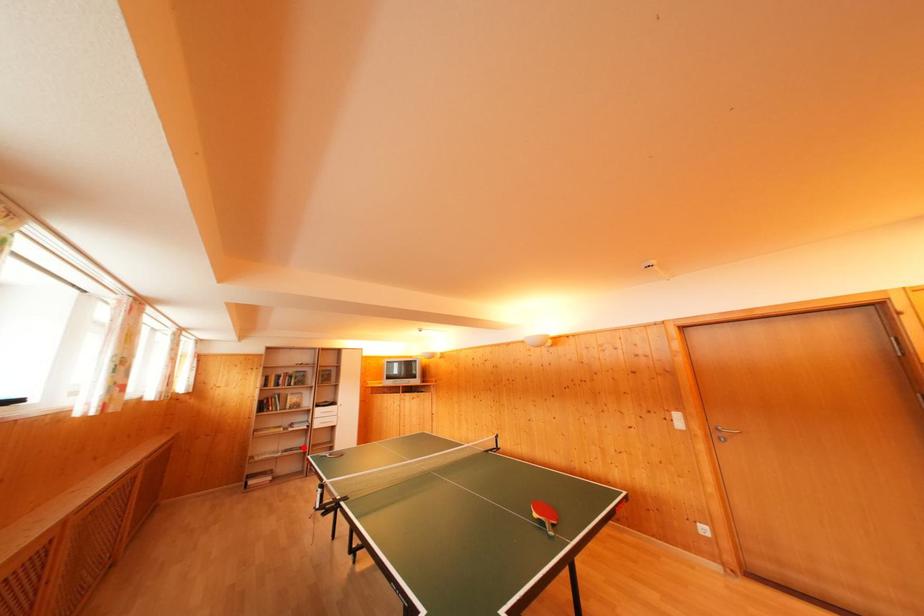
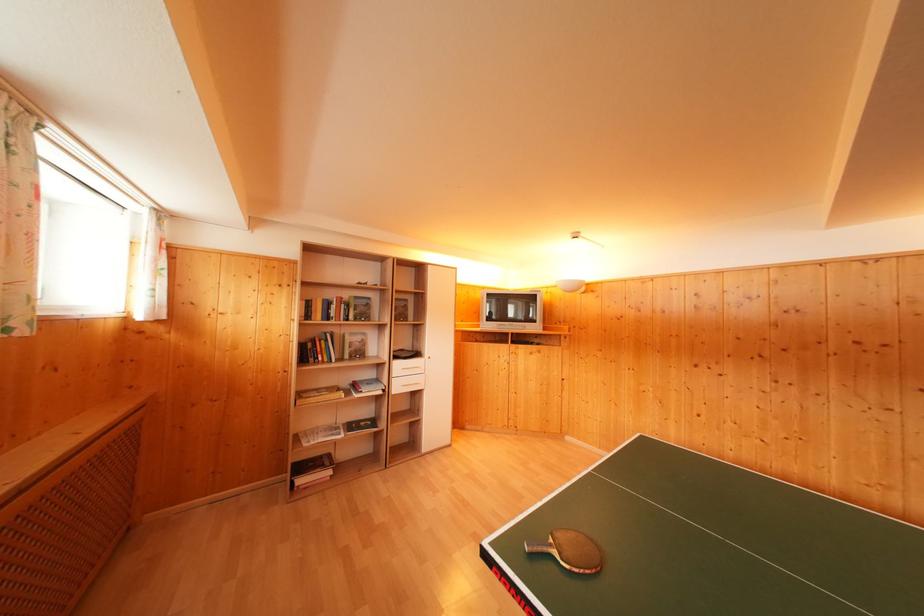
Locate, in the second image, the point that corresponds to the highlighted location in the first image.

(371, 416)